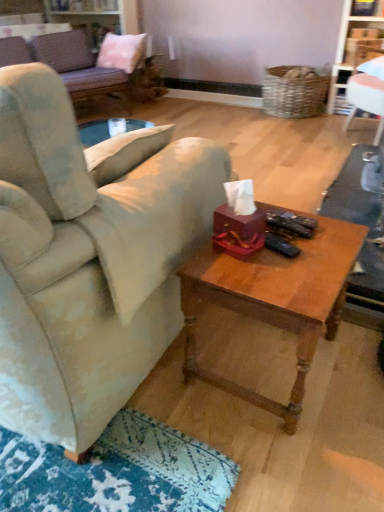
Locate an element on the screen. vacant space to the left of white glossy bookshelf at upper right is located at coordinates (305, 139).